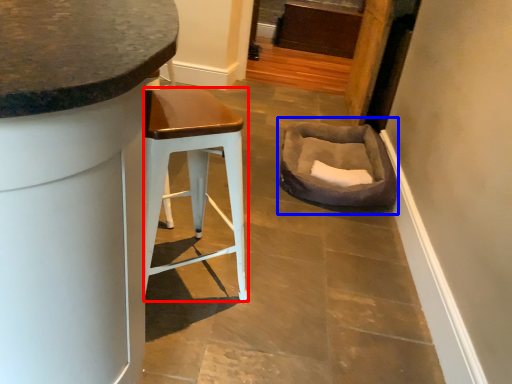
Question: Which object appears farthest to the camera in this image, stool (highlighted by a red box) or bean bag chair (highlighted by a blue box)?

Choices:
 (A) stool
 (B) bean bag chair

Answer: (B)